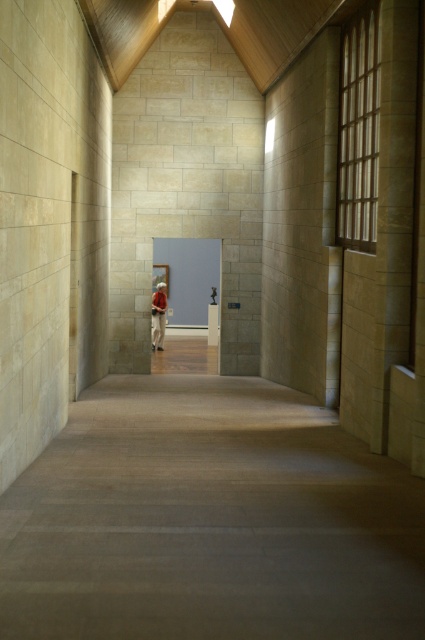
Between matte gray door at center and red fabric person at center, which one has more height?

Standing taller between the two is matte gray door at center.

Does matte gray door at center have a lesser height compared to red fabric person at center?

No, matte gray door at center is not shorter than red fabric person at center.

Between point (207, 260) and point (158, 310), which one is positioned behind?

The point (207, 260) is behind.

At what (x,y) coordinates should I click in order to perform the action: click on matte gray door at center. Please return your answer as a coordinate pair (x, y). The image size is (425, 640). Looking at the image, I should click on (189, 276).